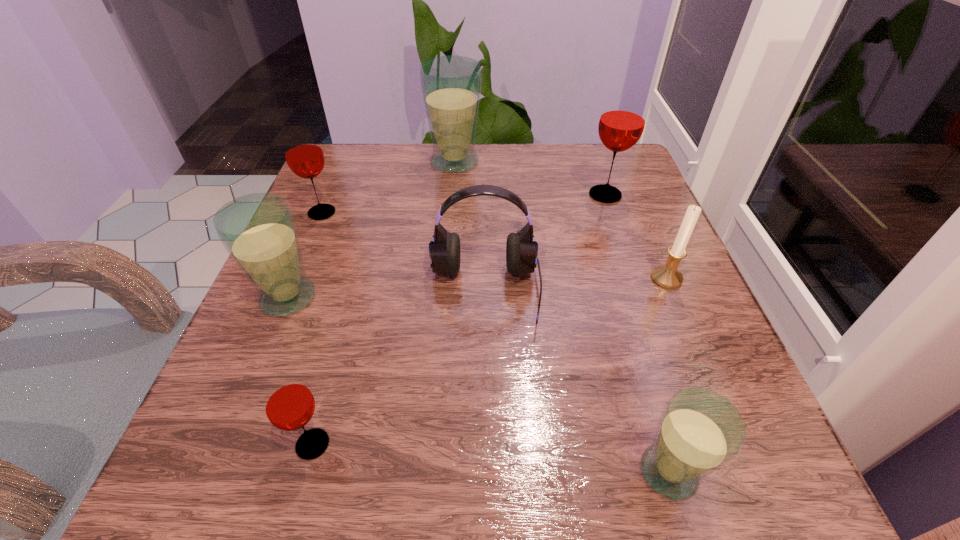
At what (x,y) coordinates should I click in order to perform the action: click on free space at the far right corner of the desktop. Please return your answer as a coordinate pair (x, y). Looking at the image, I should click on (577, 148).

In the image, there is a desktop. At what (x,y) coordinates should I click in order to perform the action: click on vacant space at the near right corner. Please return your answer as a coordinate pair (x, y). Looking at the image, I should click on (754, 444).

Image resolution: width=960 pixels, height=540 pixels. Find the location of `free spot between the headset and the third glass from right to left`. free spot between the headset and the third glass from right to left is located at coordinates (469, 227).

The image size is (960, 540). What are the coordinates of `vacant region between the nearest red glass and the second biggest blue glass` in the screenshot? It's located at (300, 371).

Identify the location of vacant region between the biggest red glass and the second smallest red glass. (464, 204).

Locate an element on the screen. vacant point located between the biggest red glass and the second red glass from left to right is located at coordinates click(x=459, y=320).

You are a GUI agent. You are given a task and a screenshot of the screen. Output one action in this format:
    pyautogui.click(x=<x>, y=<y>)
    Task: Click on the vacant space that is in between the leftmost red glass and the second smallest blue glass
    
    Given the screenshot: What is the action you would take?
    pyautogui.click(x=305, y=255)

Find the location of a particular element. This screenshot has width=960, height=540. free space between the headset and the candle holder is located at coordinates (576, 285).

Identify the location of unoccupied position between the second blue glass from right to left and the smallest blue glass. The width and height of the screenshot is (960, 540). (562, 317).

I want to click on free space between the second smallest blue glass and the fourth glass from left to right, so click(x=372, y=230).